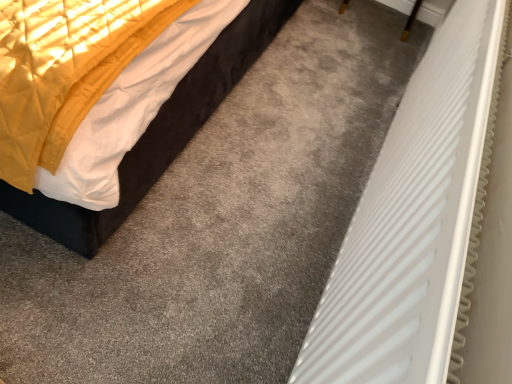
Measure the distance between point (x=395, y=148) and camera.

Point (x=395, y=148) is 3.91 feet away from camera.

Describe the element at coordinates (416, 220) in the screenshot. The width and height of the screenshot is (512, 384). I see `white matte radiator at lower right` at that location.

I want to click on white matte radiator at lower right, so click(x=416, y=220).

The height and width of the screenshot is (384, 512). What are the coordinates of `white matte radiator at lower right` in the screenshot? It's located at (416, 220).